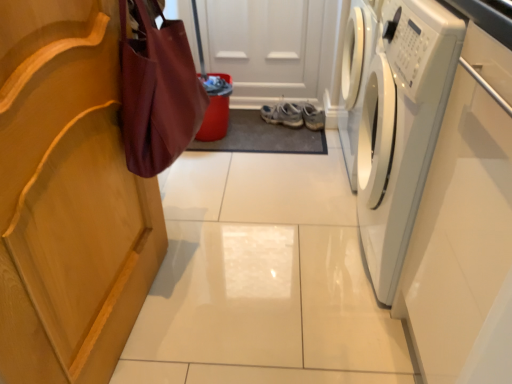
Where is `burgundy fabric bag at left`? This screenshot has height=384, width=512. burgundy fabric bag at left is located at coordinates (157, 92).

Find the location of `white glossy washing machine at right`. white glossy washing machine at right is located at coordinates (402, 129).

Measure the distance between light blue fabric sneakers at center and camera.

light blue fabric sneakers at center and camera are 2.23 meters apart.

Identify the location of burgundy fabric bag at left. (157, 92).

From the picture: Is white glossy washing machine at right aimed at burgundy fabric bag at left?

Yes, white glossy washing machine at right is aimed at burgundy fabric bag at left.

From the picture: Does white glossy washing machine at right touch burgundy fabric bag at left?

No, white glossy washing machine at right is not making contact with burgundy fabric bag at left.

How different are the orientations of white glossy washing machine at right and burgundy fabric bag at left in degrees?

They differ by 177 degrees in their facing directions.

Considering the positions of objects white glossy washing machine at right and burgundy fabric bag at left in the image provided, who is more to the right, white glossy washing machine at right or burgundy fabric bag at left?

white glossy washing machine at right.

From the image's perspective, is light blue fabric sneakers at center under burgundy fabric bag at left?

No, from the image's perspective, light blue fabric sneakers at center is not beneath burgundy fabric bag at left.

Considering the sizes of objects light blue fabric sneakers at center and burgundy fabric bag at left in the image provided, who is shorter, light blue fabric sneakers at center or burgundy fabric bag at left?

light blue fabric sneakers at center.

Does point (282, 109) come in front of point (146, 27)?

No, (282, 109) is further to viewer.

Looking at this image, considering the sizes of objects light blue fabric sneakers at center and burgundy fabric bag at left in the image provided, who is wider, light blue fabric sneakers at center or burgundy fabric bag at left?

light blue fabric sneakers at center is wider.

From the image's perspective, which is below, burgundy fabric bag at left or white glossy washing machine at right?

white glossy washing machine at right.

Does point (169, 58) come closer to viewer compared to point (424, 66)?

No, it is not.

How far apart are burgundy fabric bag at left and white glossy washing machine at right?

burgundy fabric bag at left is 22.36 inches from white glossy washing machine at right.

Is burgundy fabric bag at left wider or thinner than white glossy washing machine at right?

In the image, burgundy fabric bag at left appears to be more narrow than white glossy washing machine at right.

Is white glossy washing machine at right wider or thinner than light blue fabric sneakers at center?

Considering their sizes, white glossy washing machine at right looks broader than light blue fabric sneakers at center.

How much distance is there between white glossy washing machine at right and light blue fabric sneakers at center?

3.76 feet.

Would you say white glossy washing machine at right is a long distance from light blue fabric sneakers at center?

Yes.

Can you confirm if white glossy washing machine at right is smaller than light blue fabric sneakers at center?

No, white glossy washing machine at right is not smaller than light blue fabric sneakers at center.

Does burgundy fabric bag at left lie behind light blue fabric sneakers at center?

No, the depth of burgundy fabric bag at left is less than that of light blue fabric sneakers at center.

Considering the relative sizes of burgundy fabric bag at left and light blue fabric sneakers at center in the image provided, is burgundy fabric bag at left taller than light blue fabric sneakers at center?

Yes, burgundy fabric bag at left is taller than light blue fabric sneakers at center.

Locate an element on the screen. The width and height of the screenshot is (512, 384). shopping bag located above the light blue fabric sneakers at center (from a real-world perspective) is located at coordinates pos(157,92).

From the image's perspective, relative to light blue fabric sneakers at center, is burgundy fabric bag at left above or below?

Clearly, from the image's perspective, burgundy fabric bag at left is below light blue fabric sneakers at center.

What's the angular difference between light blue fabric sneakers at center and white glossy washing machine at right's facing directions?

132 degrees.

Is light blue fabric sneakers at center not inside white glossy washing machine at right?

light blue fabric sneakers at center lies outside white glossy washing machine at right's area.

Is point (298, 114) closer to camera compared to point (384, 121)?

No.

Find the location of a particular element. The height and width of the screenshot is (384, 512). washing machine on the right of burgundy fabric bag at left is located at coordinates (402, 129).

Locate an element on the screen. The image size is (512, 384). footwear above the burgundy fabric bag at left (from the image's perspective) is located at coordinates (283, 114).

When comparing their distances from burgundy fabric bag at left, does light blue fabric sneakers at center or white glossy washing machine at right seem closer?

white glossy washing machine at right is positioned closer to the anchor burgundy fabric bag at left.

Estimate the real-world distances between objects in this image. Which object is closer to white glossy washing machine at right, light blue fabric sneakers at center or burgundy fabric bag at left?

burgundy fabric bag at left is closer to white glossy washing machine at right.

Based on the photo, when comparing their distances from white glossy washing machine at right, does burgundy fabric bag at left or light blue fabric sneakers at center seem further?

Based on the image, light blue fabric sneakers at center appears to be further to white glossy washing machine at right.

Considering their positions, is white glossy washing machine at right positioned closer to light blue fabric sneakers at center than burgundy fabric bag at left?

white glossy washing machine at right.

From the image, which object appears to be farther from light blue fabric sneakers at center, burgundy fabric bag at left or white glossy washing machine at right?

burgundy fabric bag at left.

Based on their spatial positions, is white glossy washing machine at right or light blue fabric sneakers at center closer to burgundy fabric bag at left?

Among the two, white glossy washing machine at right is located nearer to burgundy fabric bag at left.

Locate an element on the screen. shopping bag located between white glossy washing machine at right and light blue fabric sneakers at center in the depth direction is located at coordinates (157, 92).